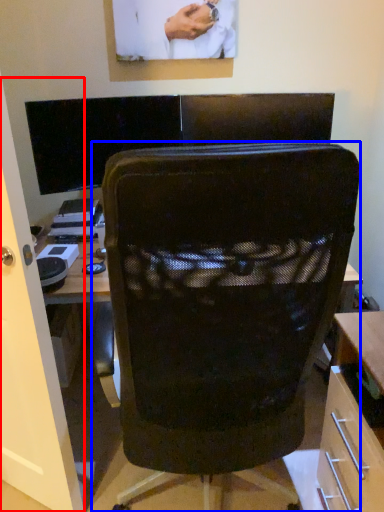
Question: Which of the following is the farthest to the observer, glass door (highlighted by a red box) or chair (highlighted by a blue box)?

Choices:
 (A) glass door
 (B) chair

Answer: (A)